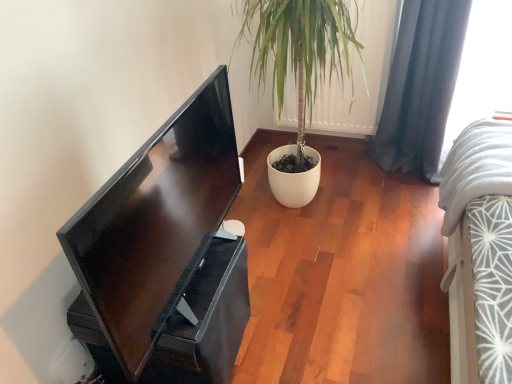
Question: Would you say dark blue fabric curtain at right is to the left or to the right of matte black monitor at left in the picture?

Choices:
 (A) right
 (B) left

Answer: (A)

Question: From their relative heights in the image, would you say dark blue fabric curtain at right is taller or shorter than matte black monitor at left?

Choices:
 (A) short
 (B) tall

Answer: (B)

Question: Which is farther from the white fabric at upper right?

Choices:
 (A) matte black monitor at left
 (B) dark blue fabric curtain at right

Answer: (A)

Question: Estimate the real-world distances between objects in this image. Which object is farther from the dark blue fabric curtain at right?

Choices:
 (A) matte black monitor at left
 (B) white fabric at upper right

Answer: (A)